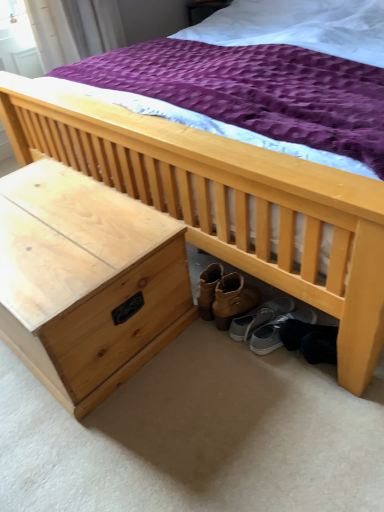
Question: Is natural wood nightstand at lower left a part of gray suede sneakers at lower right, the 1th footwear positioned from the right?

Choices:
 (A) no
 (B) yes

Answer: (A)

Question: From the image's perspective, is gray suede sneakers at lower right, the 1th footwear positioned from the right, on natural wood nightstand at lower left?

Choices:
 (A) yes
 (B) no

Answer: (B)

Question: From a real-world perspective, is gray suede sneakers at lower right, acting as the 2th footwear starting from the left, beneath natural wood nightstand at lower left?

Choices:
 (A) yes
 (B) no

Answer: (A)

Question: Is gray suede sneakers at lower right, the 1th footwear positioned from the right, next to natural wood nightstand at lower left and touching it?

Choices:
 (A) no
 (B) yes

Answer: (A)

Question: Does gray suede sneakers at lower right, acting as the 2th footwear starting from the left, have a lesser width compared to natural wood nightstand at lower left?

Choices:
 (A) no
 (B) yes

Answer: (B)

Question: Is gray suede sneakers at lower right, acting as the 2th footwear starting from the left, smaller than natural wood nightstand at lower left?

Choices:
 (A) yes
 (B) no

Answer: (A)

Question: Is gray suede sneakers at lower right, the 1th footwear positioned from the right, thinner than gray fabric shoe at under bed, the second footwear when ordered from right to left?

Choices:
 (A) yes
 (B) no

Answer: (B)

Question: Is gray suede sneakers at lower right, the 1th footwear positioned from the right, oriented away from gray fabric shoe at under bed, the first footwear viewed from the left?

Choices:
 (A) no
 (B) yes

Answer: (A)

Question: Does gray suede sneakers at lower right, acting as the 2th footwear starting from the left, have a greater height compared to gray fabric shoe at under bed, the first footwear viewed from the left?

Choices:
 (A) no
 (B) yes

Answer: (A)

Question: Is gray suede sneakers at lower right, acting as the 2th footwear starting from the left, oriented towards gray fabric shoe at under bed, the second footwear when ordered from right to left?

Choices:
 (A) yes
 (B) no

Answer: (B)

Question: From the image's perspective, is gray suede sneakers at lower right, the 1th footwear positioned from the right, located above gray fabric shoe at under bed, the first footwear viewed from the left?

Choices:
 (A) no
 (B) yes

Answer: (A)

Question: Does gray suede sneakers at lower right, acting as the 2th footwear starting from the left, lie behind gray fabric shoe at under bed, the second footwear when ordered from right to left?

Choices:
 (A) no
 (B) yes

Answer: (A)

Question: Can you confirm if gray fabric shoe at under bed, the first footwear viewed from the left, is taller than gray suede sneakers at lower right, the 1th footwear positioned from the right?

Choices:
 (A) no
 (B) yes

Answer: (B)